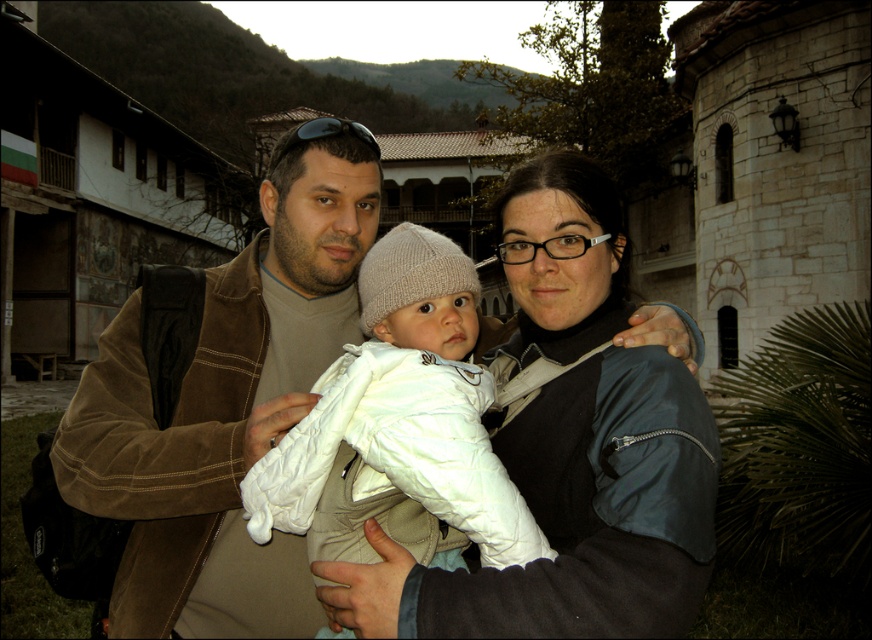
Question: Which of the following is the closest to the observer?

Choices:
 (A) white soft fabric baby at center
 (B) brown suede jacket at center

Answer: (A)

Question: Can you confirm if brown suede jacket at center is bigger than white soft fabric baby at center?

Choices:
 (A) yes
 (B) no

Answer: (A)

Question: Which object appears closest to the camera in this image?

Choices:
 (A) brown suede jacket at center
 (B) white soft fabric baby at center

Answer: (B)

Question: From the image, what is the correct spatial relationship of brown suede jacket at center in relation to white soft fabric baby at center?

Choices:
 (A) below
 (B) above

Answer: (B)

Question: Can you confirm if brown suede jacket at center is positioned below white soft fabric baby at center?

Choices:
 (A) no
 (B) yes

Answer: (A)